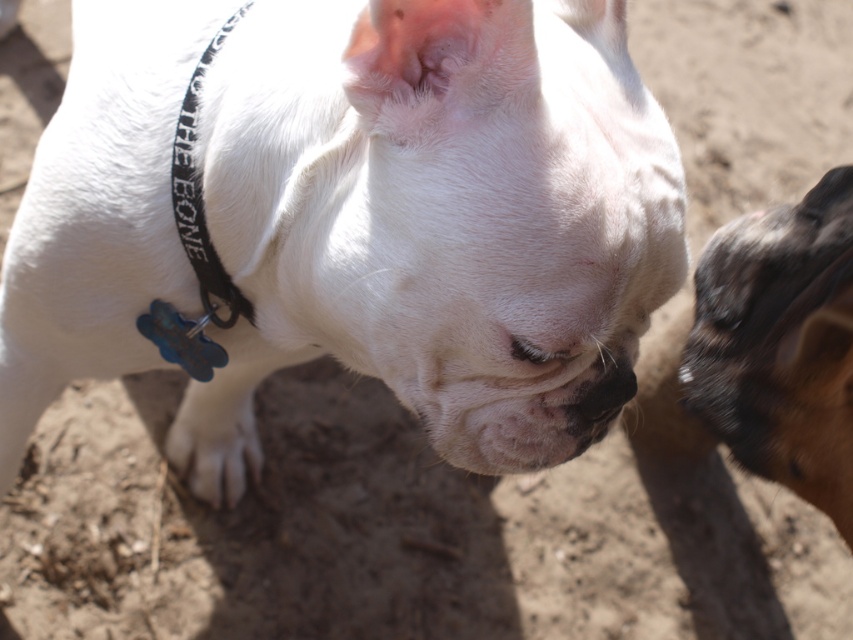
You are a dog owner trying to identify which part of your dogs is wider. You see the brown fur at right and the white fur paw at lower center. Which one is wider?

The white fur paw at lower center is wider than the brown fur at right.

You are taking a photo of two dogs. The first dog is at point (767, 445) and the second dog is at point (207, 317). Which dog is closer to your camera?

Point (767, 445) is closer to the camera than point (207, 317).

You are holding a measuring tape and need to determine the distance between yourself and a specific point in the image. The point is marked at coordinates point (850, 476). Can you confirm if this distance is more than 1 meter?

The point (850, 476) is 95.01 centimeters away from the viewer, so the distance is less than 1 meter.